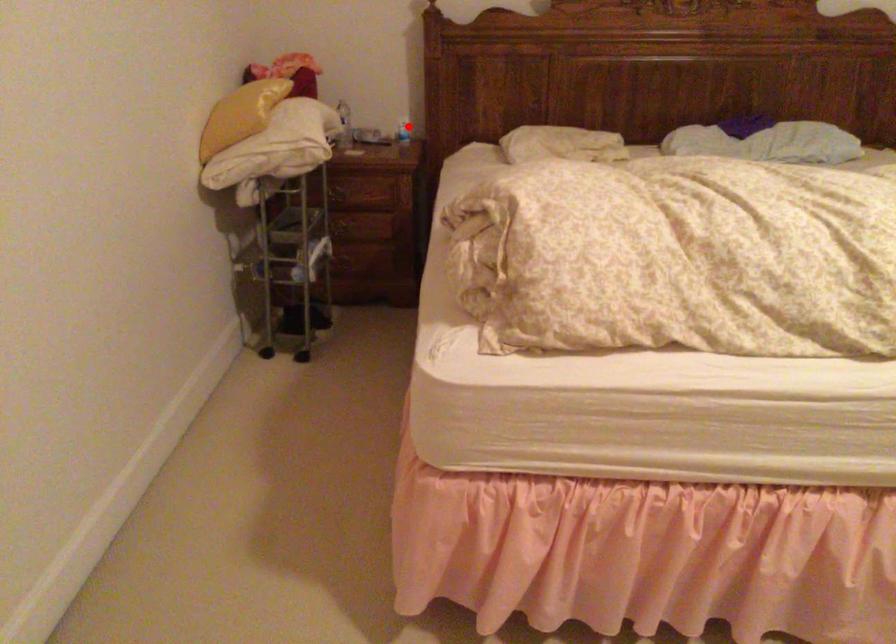
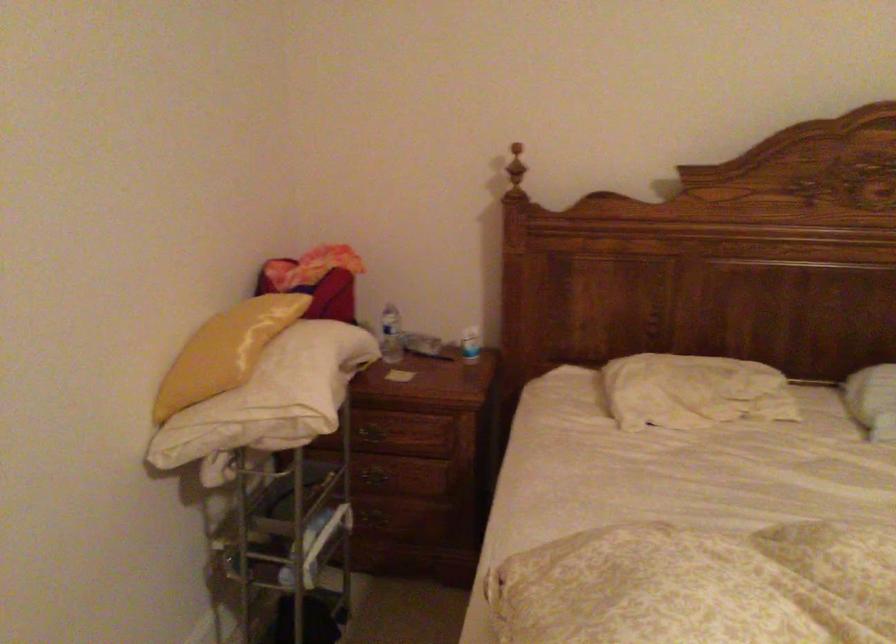
Question: A red point is marked in image1. In image2, is the corresponding 3D point closer to the camera or farther? Reply with the corresponding letter.

Choices:
 (A) The corresponding 3D point is closer.
 (B) The corresponding 3D point is farther.

Answer: (A)